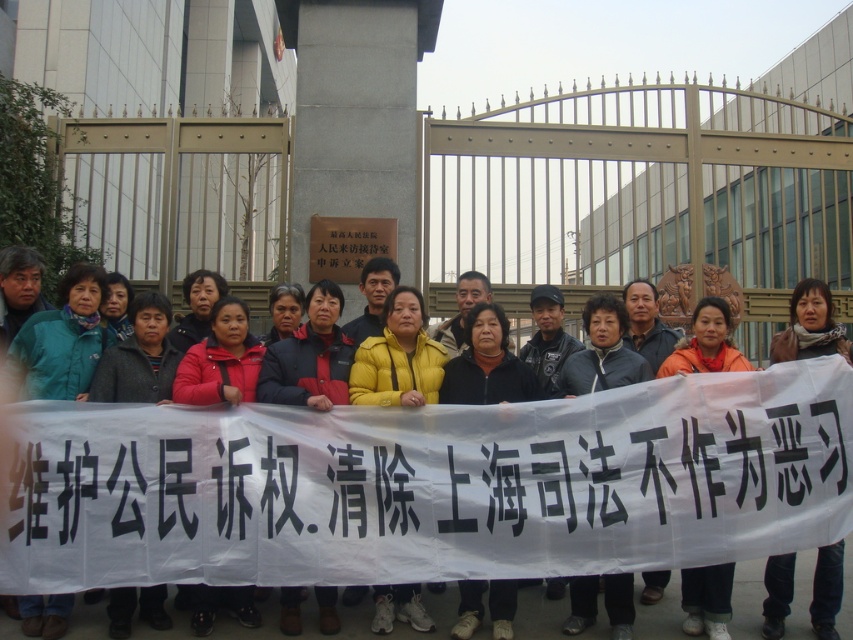
Question: Which of the following is the closest to the observer?

Choices:
 (A) (317, 417)
 (B) (492, 477)

Answer: (B)

Question: Where is yellow fabric jacket at center located in relation to black paper banner at center in the image?

Choices:
 (A) above
 (B) below

Answer: (B)

Question: Can you confirm if yellow fabric jacket at center is smaller than black paper banner at center?

Choices:
 (A) yes
 (B) no

Answer: (A)

Question: Can you confirm if yellow fabric jacket at center is wider than black paper banner at center?

Choices:
 (A) no
 (B) yes

Answer: (A)

Question: Among these objects, which one is nearest to the camera?

Choices:
 (A) black paper banner at center
 (B) yellow fabric jacket at center

Answer: (B)

Question: Which of the following is the closest to the observer?

Choices:
 (A) yellow fabric jacket at center
 (B) black paper banner at center

Answer: (A)